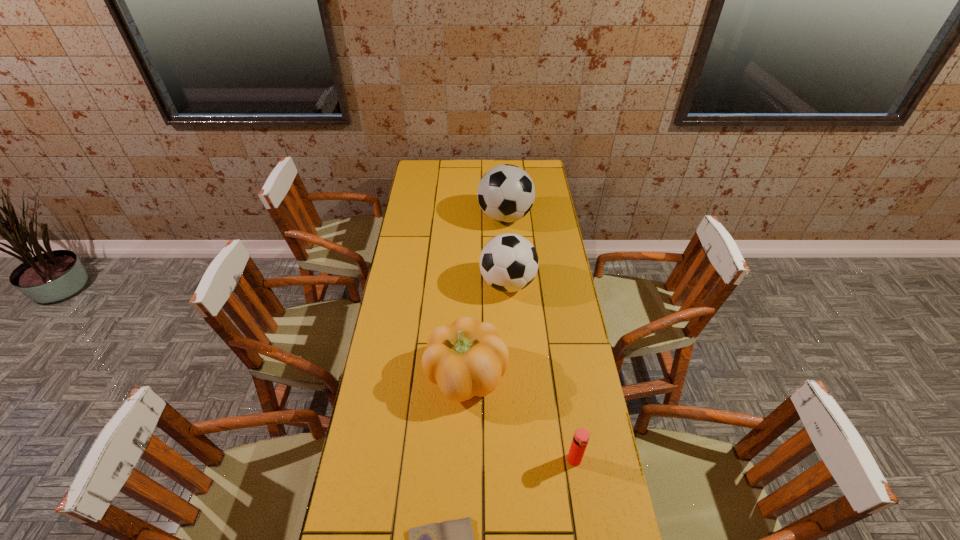
This screenshot has width=960, height=540. What are the coordinates of `the farther soccer ball` in the screenshot? It's located at (506, 193).

Where is `the fourth nearest object`? This screenshot has width=960, height=540. the fourth nearest object is located at coordinates (508, 262).

The height and width of the screenshot is (540, 960). In order to click on the shorter soccer ball in this screenshot , I will do `click(508, 262)`.

In order to click on pumpkin in this screenshot , I will do `click(467, 358)`.

The height and width of the screenshot is (540, 960). I want to click on the second shortest object, so [581, 436].

You are a GUI agent. You are given a task and a screenshot of the screen. Output one action in this format:
    pyautogui.click(x=<x>, y=<y>)
    Task: Click on the thermos bottle
    The image size is (960, 540).
    Given the screenshot: What is the action you would take?
    pyautogui.click(x=581, y=436)

This screenshot has height=540, width=960. Identify the location of vacant region located on the front of the farther soccer ball. (511, 293).

The image size is (960, 540). Find the location of `vacant area located 0.320m on the front of the fourth nearest object`. vacant area located 0.320m on the front of the fourth nearest object is located at coordinates (514, 374).

Image resolution: width=960 pixels, height=540 pixels. Identify the location of vacant area situated 0.170m on the back of the third farthest object. (468, 308).

Image resolution: width=960 pixels, height=540 pixels. I want to click on vacant region located on the back of the thermos bottle, so click(563, 383).